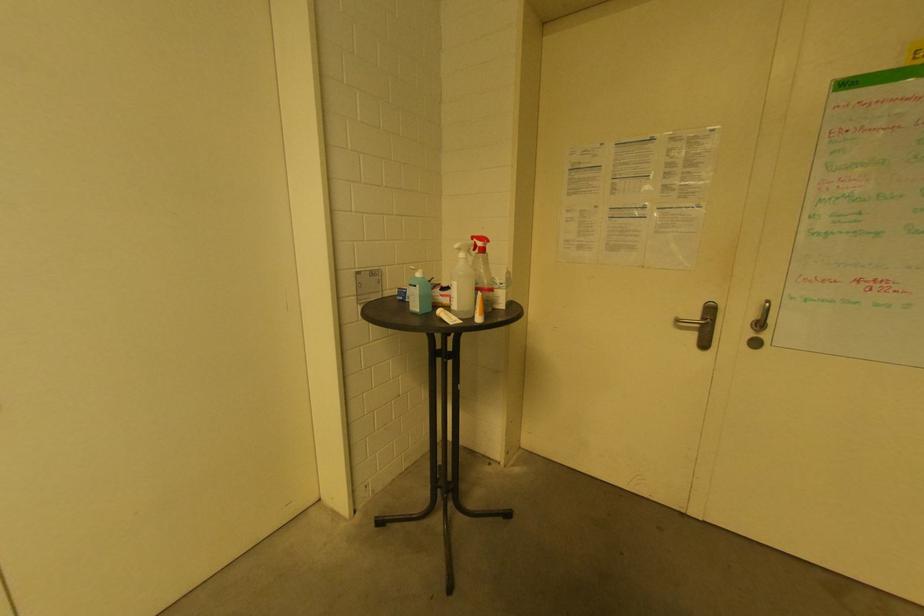
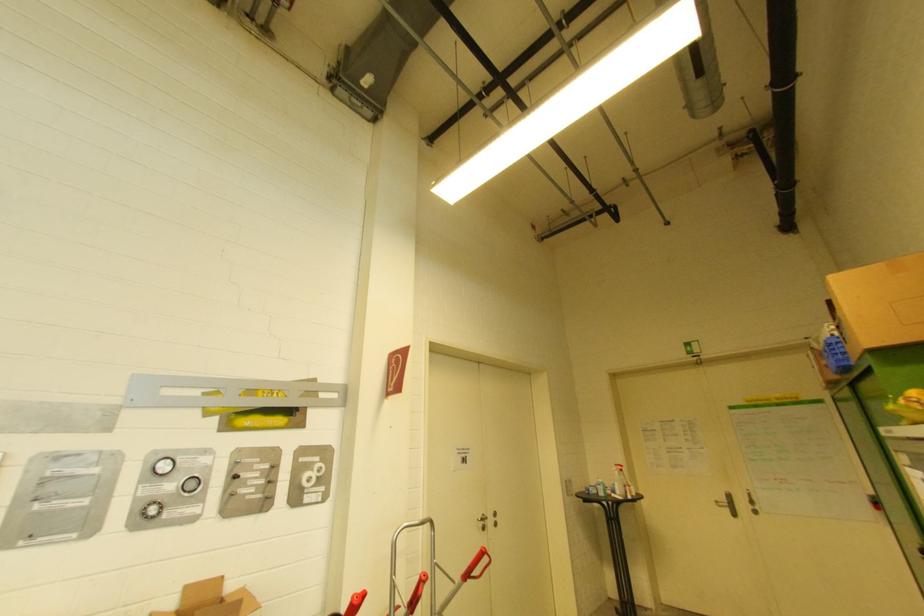
Locate, in the second image, the point that corresponds to [712,313] in the first image.

(731, 498)